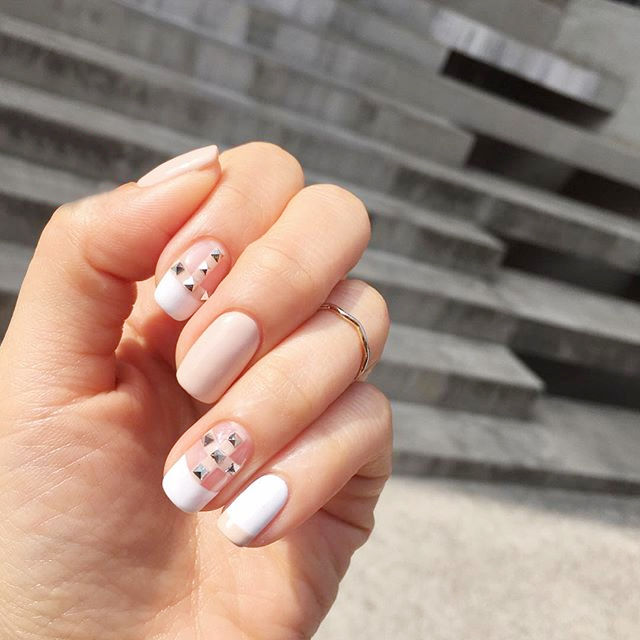
Locate an element on the screen. The width and height of the screenshot is (640, 640). stairs is located at coordinates (420, 227).